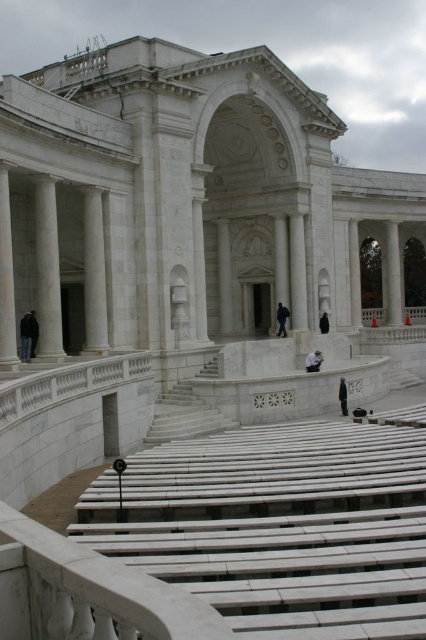
Question: Is white fabric bag at center positioned at the back of black fabric coat at center?

Choices:
 (A) no
 (B) yes

Answer: (B)

Question: Which object appears closest to the camera in this image?

Choices:
 (A) white marble stairs at lower center
 (B) white marble pillar at left
 (C) blue fabric jacket at center

Answer: (A)

Question: Is white marble stairs at lower center in front of black fabric person at center?

Choices:
 (A) no
 (B) yes

Answer: (B)

Question: Does white marble column at center appear on the left side of white fabric bag at center?

Choices:
 (A) no
 (B) yes

Answer: (B)

Question: Based on their relative distances, which object is farther from the white marble stairs at lower center?

Choices:
 (A) white marble column at center
 (B) white marble pillar at left
 (C) black fabric person at center

Answer: (C)

Question: Which of the following is the closest to the observer?

Choices:
 (A) black fabric person at center
 (B) white marble column at left
 (C) white marble stairs at lower center
 (D) black leather jacket at left

Answer: (C)